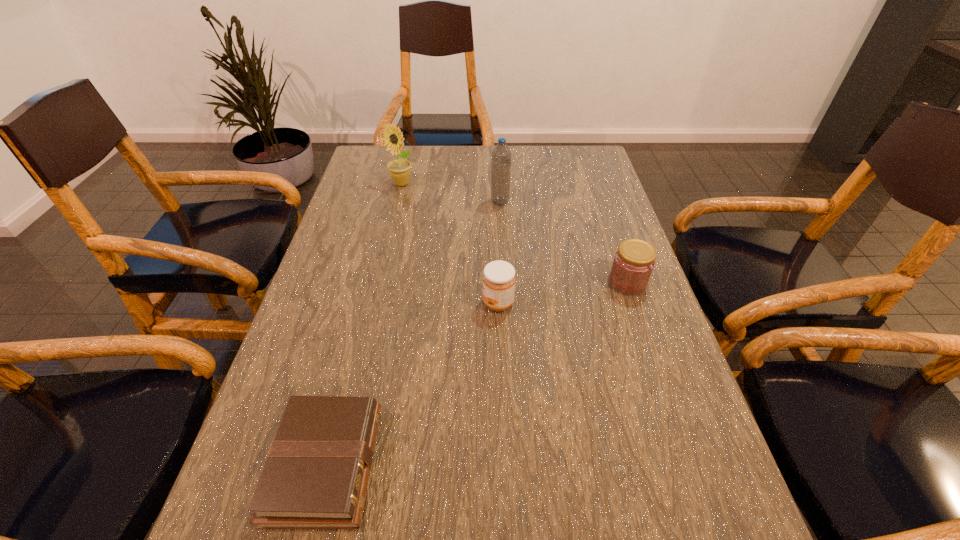
Locate an element on the screen. Image resolution: width=960 pixels, height=540 pixels. free spot located on the front label of the left jam is located at coordinates (395, 303).

Identify the location of free space located on the front label of the left jam. This screenshot has width=960, height=540. (412, 303).

Where is `vacant point located 0.310m on the spine side of the nearest object`? This screenshot has width=960, height=540. vacant point located 0.310m on the spine side of the nearest object is located at coordinates (558, 463).

Where is `object at the far edge`? object at the far edge is located at coordinates (399, 170).

Where is `sunflower that is at the left edge`? The image size is (960, 540). sunflower that is at the left edge is located at coordinates (399, 170).

Find the location of a particular element. The height and width of the screenshot is (540, 960). Bible situated at the left edge is located at coordinates (316, 474).

Where is `object present at the right edge`? This screenshot has height=540, width=960. object present at the right edge is located at coordinates (633, 263).

Identify the location of object that is at the far left corner. (399, 170).

The width and height of the screenshot is (960, 540). In order to click on vacant region at the far edge in this screenshot , I will do `click(463, 163)`.

Identify the location of vacant space at the left edge. Image resolution: width=960 pixels, height=540 pixels. (312, 300).